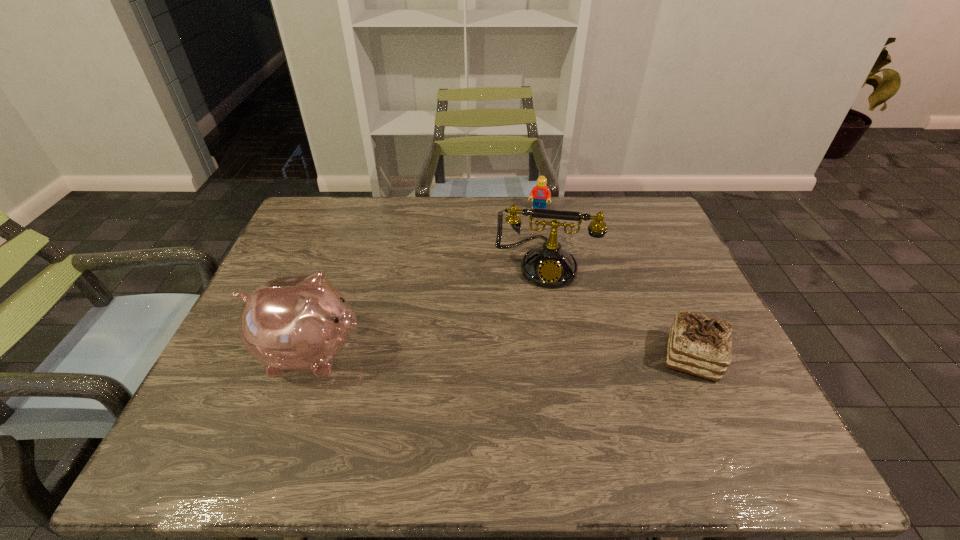
In the image, there is a desktop. Where is `vacant region at the near edge`? This screenshot has height=540, width=960. vacant region at the near edge is located at coordinates (x=315, y=416).

You are a GUI agent. You are given a task and a screenshot of the screen. Output one action in this format:
    pyautogui.click(x=<x>, y=<y>)
    Task: Click on the vacant space at the left edge of the desktop
    
    Given the screenshot: What is the action you would take?
    pyautogui.click(x=286, y=258)

In the image, there is a desktop. Where is `vacant space at the right edge`? The width and height of the screenshot is (960, 540). vacant space at the right edge is located at coordinates (661, 261).

Find the location of `free point at the far left corner`. free point at the far left corner is located at coordinates (325, 217).

At what (x,y) coordinates should I click in order to perform the action: click on free spot between the leftmost object and the Lego. Please return your answer as a coordinate pair (x, y). The width and height of the screenshot is (960, 540). Looking at the image, I should click on (425, 281).

At what (x,y) coordinates should I click in order to perform the action: click on blank region between the rightmost object and the leftmost object. Please return your answer as a coordinate pair (x, y). The image size is (960, 540). Looking at the image, I should click on (502, 355).

The image size is (960, 540). Find the location of `empty location between the farthest object and the third nearest object`. empty location between the farthest object and the third nearest object is located at coordinates (541, 238).

Where is `vacant area between the third nearest object and the chocolate cake`? This screenshot has height=540, width=960. vacant area between the third nearest object and the chocolate cake is located at coordinates (618, 311).

Find the location of a particular element. The image size is (960, 540). free area in between the chocolate cake and the leftmost object is located at coordinates (502, 355).

This screenshot has height=540, width=960. I want to click on free spot between the chocolate cake and the leftmost object, so click(x=502, y=355).